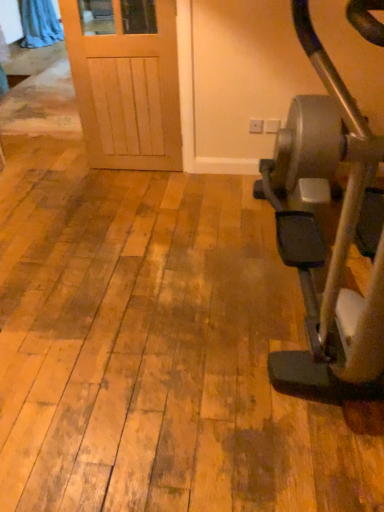
Where is `vacant point to the left of metallic gray stationary bicycle at right`? vacant point to the left of metallic gray stationary bicycle at right is located at coordinates (147, 308).